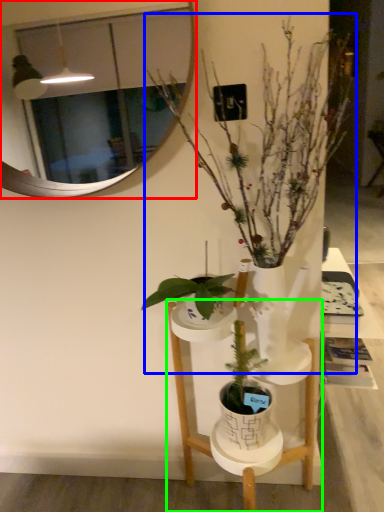
Question: Estimate the real-world distances between objects in this image. Which object is farther from mirror (highlighted by a red box), houseplant (highlighted by a blue box) or furniture (highlighted by a green box)?

Choices:
 (A) houseplant
 (B) furniture

Answer: (B)